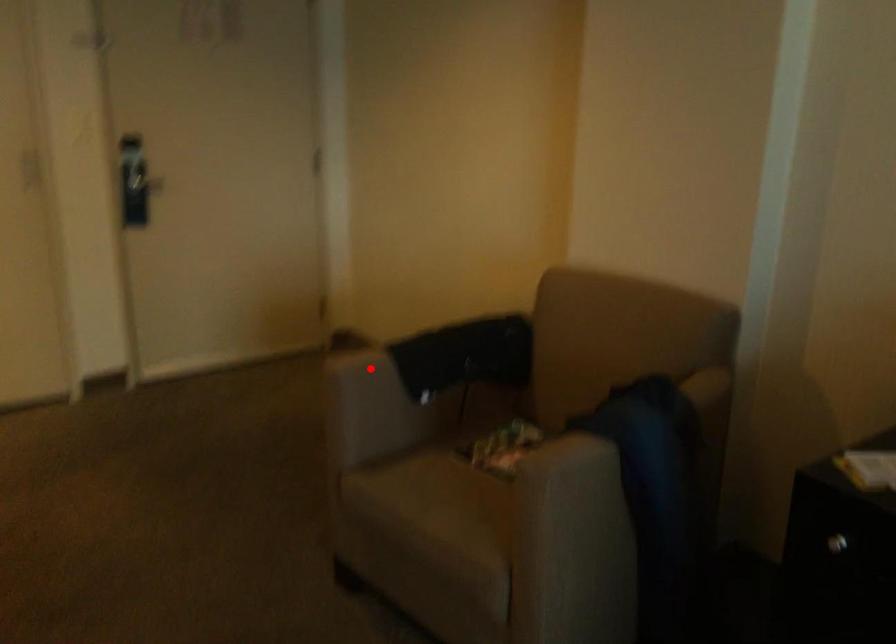
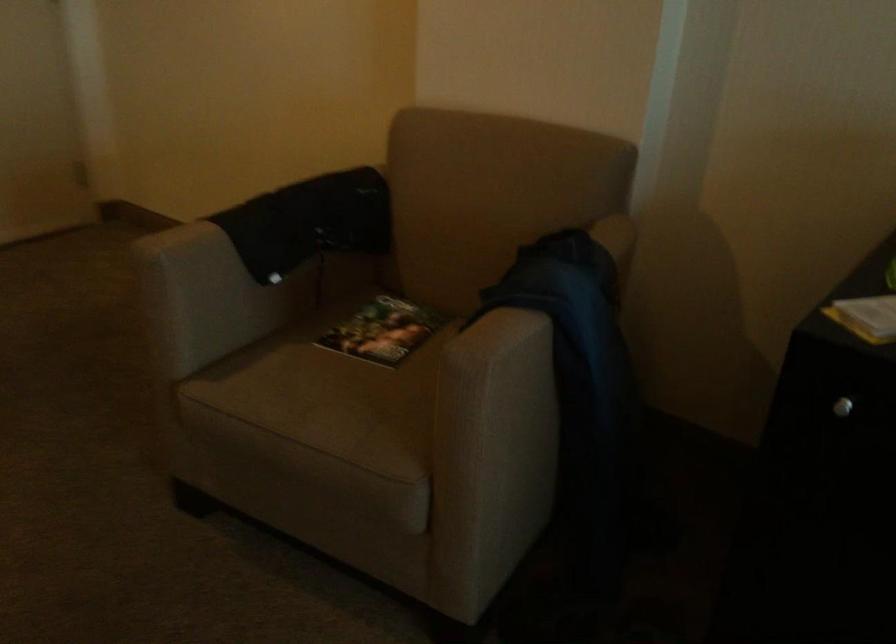
Question: A red point is marked in image1. In image2, is the corresponding 3D point closer to the camera or farther? Reply with the corresponding letter.

Choices:
 (A) The corresponding 3D point is closer.
 (B) The corresponding 3D point is farther.

Answer: (A)